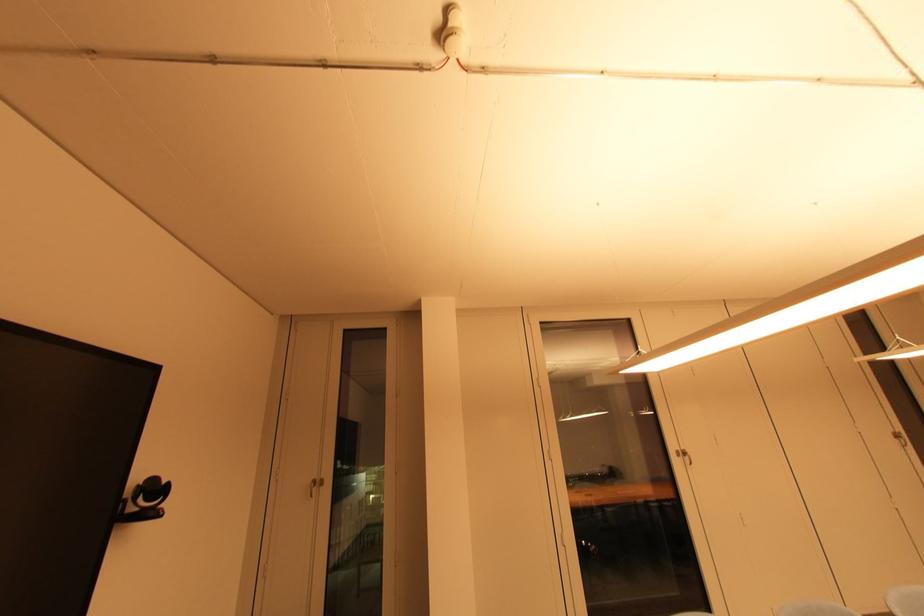
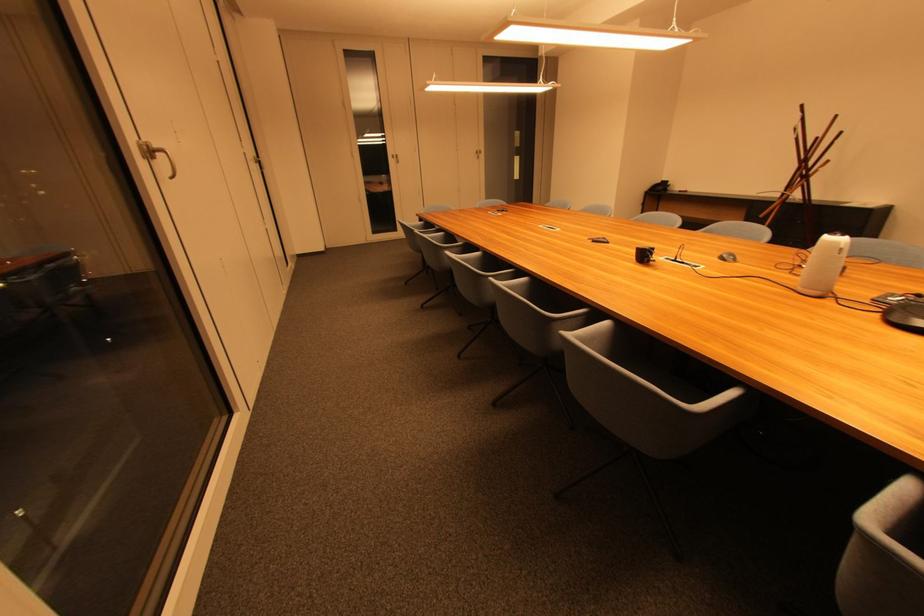
Locate, in the second image, the point that corresponds to point 685,458 in the first image.

(148, 159)